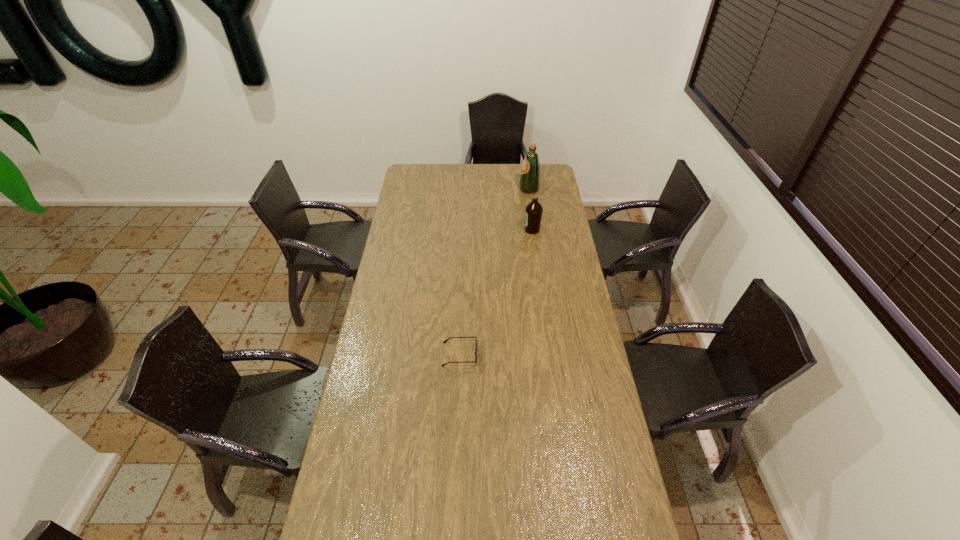
Image resolution: width=960 pixels, height=540 pixels. Find the location of `vacant space located 0.070m on the label of the second nearest object`. vacant space located 0.070m on the label of the second nearest object is located at coordinates (510, 230).

In order to click on blank space located 0.220m on the label of the second nearest object in this screenshot , I will do tap(482, 230).

You are a GUI agent. You are given a task and a screenshot of the screen. Output one action in this format:
    pyautogui.click(x=<x>, y=<y>)
    Task: Click on the vacant space positioned on the front-facing side of the leftmost object
    
    Given the screenshot: What is the action you would take?
    pyautogui.click(x=568, y=355)

In order to click on object that is at the far edge in this screenshot , I will do `click(530, 175)`.

Locate an element on the screen. Image resolution: width=960 pixels, height=540 pixels. object located at the far right corner is located at coordinates (530, 175).

Locate an element on the screen. This screenshot has width=960, height=540. vacant space at the far edge is located at coordinates (433, 179).

Image resolution: width=960 pixels, height=540 pixels. Identify the location of vacant space at the left edge. (413, 242).

Where is `free area in between the second shortest object and the leftmost object`? The image size is (960, 540). free area in between the second shortest object and the leftmost object is located at coordinates (496, 292).

The height and width of the screenshot is (540, 960). Identify the location of empty space between the farthest object and the spectacles. tap(494, 272).

Image resolution: width=960 pixels, height=540 pixels. What are the coordinates of `free space that is in between the shorter olive oil and the spectacles` in the screenshot? It's located at [x=496, y=292].